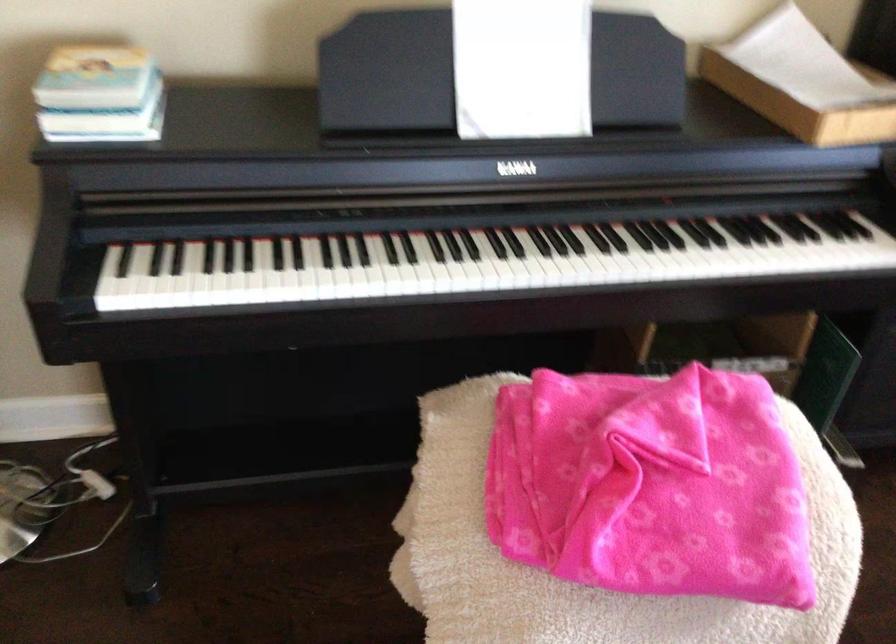
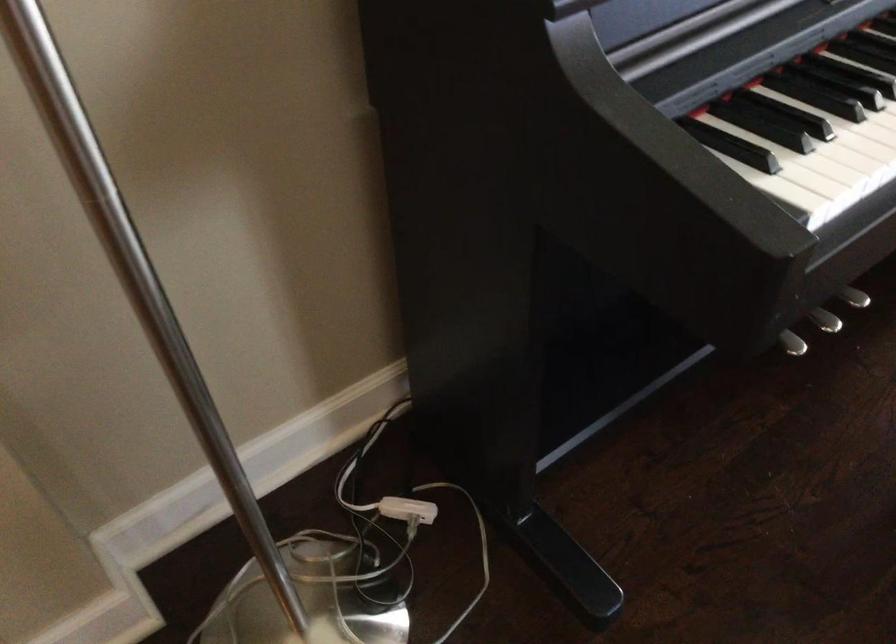
Find the pixel in the second image that matches point 156,307 in the first image.

(851, 196)